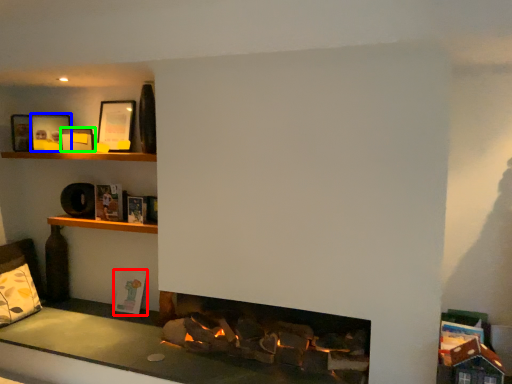
Question: Estimate the real-world distances between objects in this image. Which object is farther from book (highlighted by a red box), picture frame (highlighted by a blue box) or picture frame (highlighted by a green box)?

Choices:
 (A) picture frame
 (B) picture frame

Answer: (A)